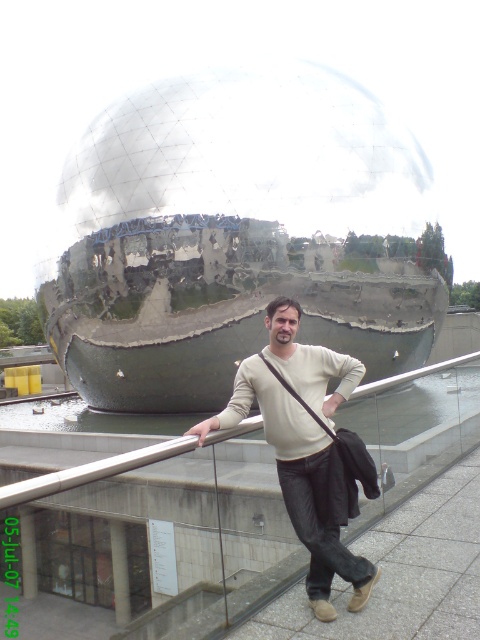
You are standing at the position of the man in the image and want to take a photo of both the point at coordinates point (317, 426) and point (99, 467). Which point should you focus on first to ensure both are in clear view?

You should focus on point (317, 426) first because it is closer to the camera than point (99, 467), ensuring both points are in clear focus.